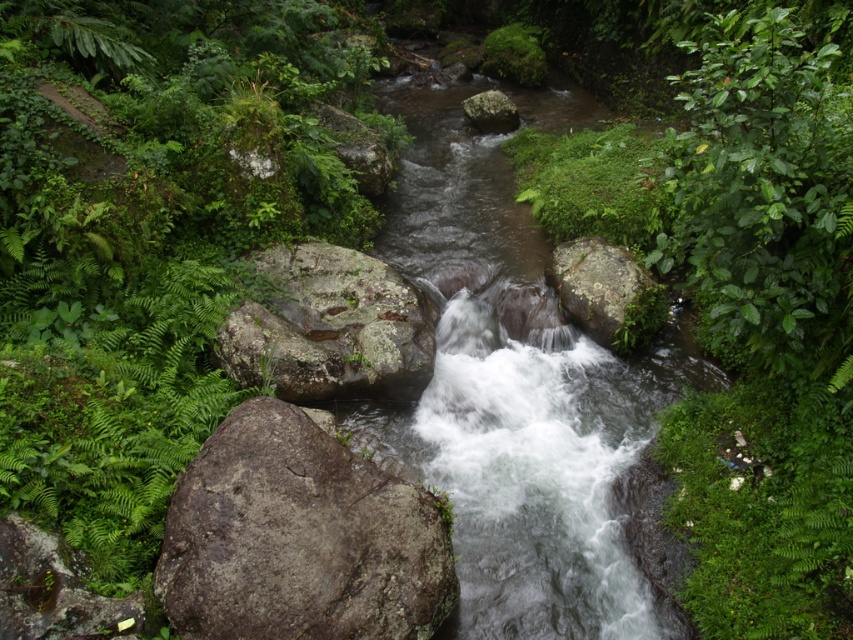
You are standing at the edge of the stream and want to place a small potted plant between the gray rough rock at lower left and the green mossy rock at lower left. Which rock should you place it closer to in order to keep it as far away from the flowing water as possible?

You should place the small potted plant closer to the gray rough rock at lower left because it is closer to you than the green mossy rock at lower left, so positioning it near the gray rough rock would keep it farther from the flowing water.

You are standing at the edge of the stream in the forest scene. You see a gray rough rock at lower left. Is there any object at the coordinate point (299, 538)?

Yes, the point (299, 538) corresponds to the gray rough rock at lower left.